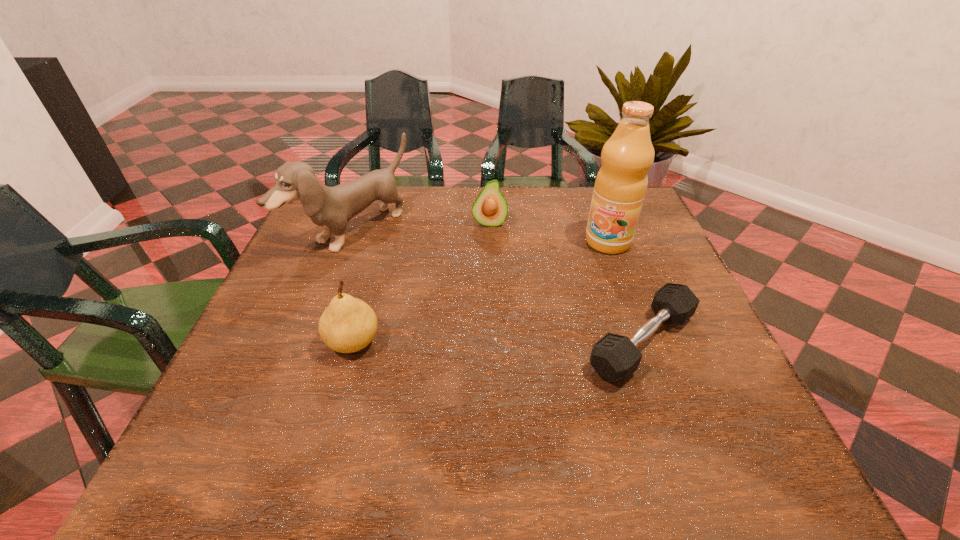
At what (x,y) coordinates should I click in order to perform the action: click on vacant space located 0.390m on the cut side of the third object from left to right. Please return your answer as a coordinate pair (x, y). The image size is (960, 540). Looking at the image, I should click on (488, 344).

Identify the location of vacant space positioned 0.250m on the cut side of the third object from left to right. The height and width of the screenshot is (540, 960). [489, 295].

Find the location of a particular element. This screenshot has width=960, height=540. free space located on the cut side of the third object from left to right is located at coordinates (488, 318).

This screenshot has width=960, height=540. Identify the location of vacant space located on the front label of the tallest object. (559, 302).

This screenshot has height=540, width=960. I want to click on vacant space located on the front label of the tallest object, so click(565, 294).

Find the location of a particular element. The height and width of the screenshot is (540, 960). free space located on the front label of the tallest object is located at coordinates (588, 266).

Locate an element on the screen. This screenshot has width=960, height=540. puppy that is at the far edge is located at coordinates (331, 208).

Image resolution: width=960 pixels, height=540 pixels. Identify the location of avocado present at the far edge. (490, 208).

The image size is (960, 540). Identify the location of fruit juice situated at the far edge. (621, 183).

Identify the location of object that is at the near edge. (615, 357).